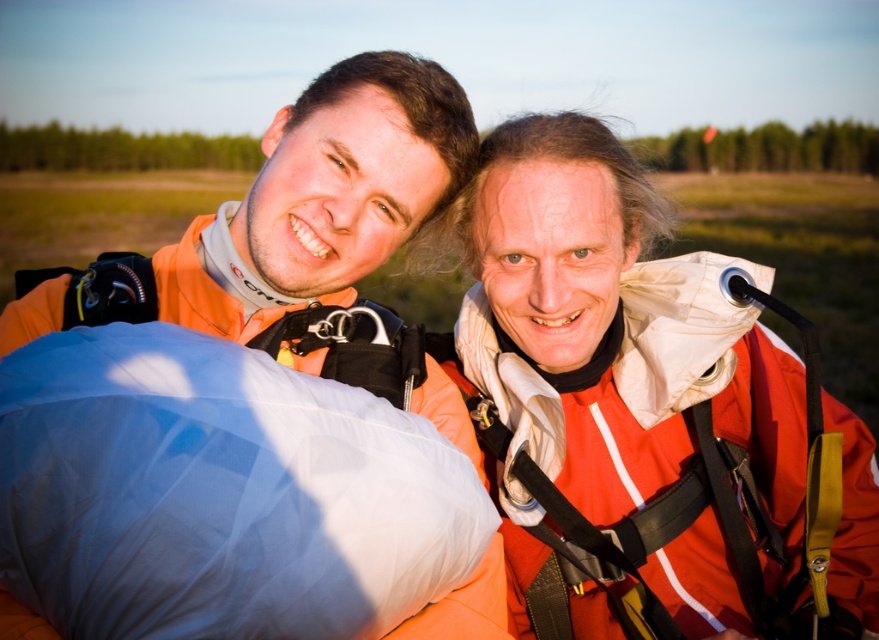
You are planning to pack a backpack and have the matte orange jumpsuit at center and the blue fabric sleeping bag at lower left. Based on their sizes, which item will take up more space in the backpack?

The matte orange jumpsuit at center is wider than the blue fabric sleeping bag at lower left, so it will take up more space in the backpack.

You are a photographer trying to capture the matte orange jumpsuit at center in your shot. Given that your camera has a focal length of 50mm and you are positioned at point A, which is 10 meters away from the jumpsuit. To ensure the jumpsuit fills the frame vertically, what is the minimum height of the camera sensor required? Assume the sensor aspect ratio is 3.5mm per meter of distance.

The matte orange jumpsuit at center is positioned at point (645,406). Using the formula sensor height equals object height multiplied by focal length divided by distance, the minimum sensor height required would be calculated as follows. However, without knowing the actual height of the jumpsuit, an exact value cannot be determined. Please provide additional measurements for accurate calculation.

You are a photographer standing in the field. You want to take a photo that includes both the matte orange jumpsuit at center and the blue fabric sleeping bag at lower left. Which object should you adjust your camera focus to first to ensure both are in focus?

The matte orange jumpsuit at center is closer to the photographer than the blue fabric sleeping bag at lower left. To ensure both are in focus, adjust the camera focus to the matte orange jumpsuit at center first, then the blue fabric sleeping bag at lower left will naturally come into focus as it is further away.